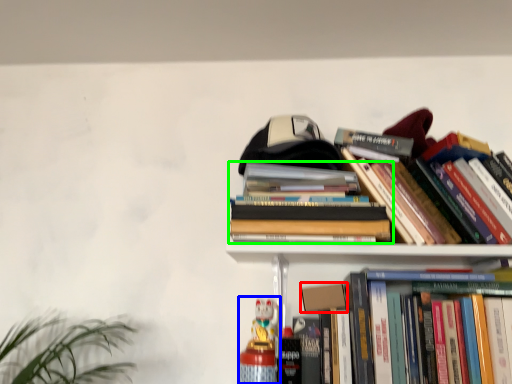
Question: Considering the real-world distances, which object is closest to paperback book (highlighted by a red box)? toy (highlighted by a blue box) or book (highlighted by a green box).

Choices:
 (A) toy
 (B) book

Answer: (A)